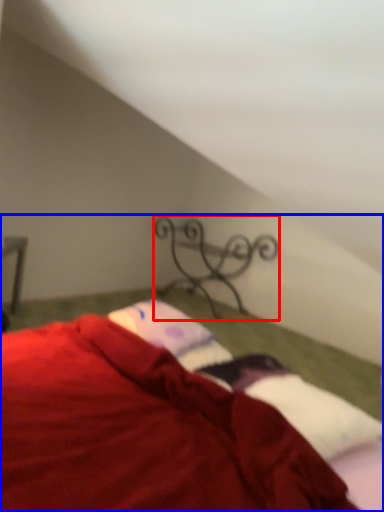
Question: Which of the following is the farthest to the observer, design (highlighted by a red box) or bed (highlighted by a blue box)?

Choices:
 (A) design
 (B) bed

Answer: (A)